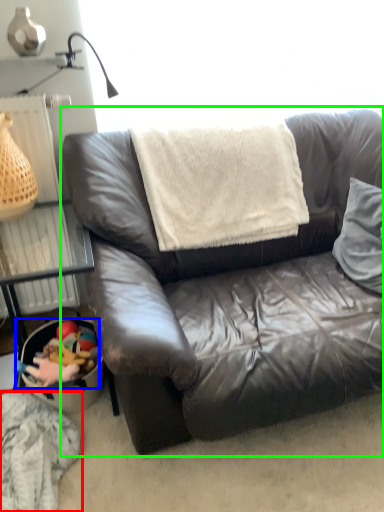
Question: Which object is positioned farthest from material (highlighted by a red box)? Select from stuff (highlighted by a blue box) and studio couch (highlighted by a green box).

Choices:
 (A) stuff
 (B) studio couch

Answer: (B)